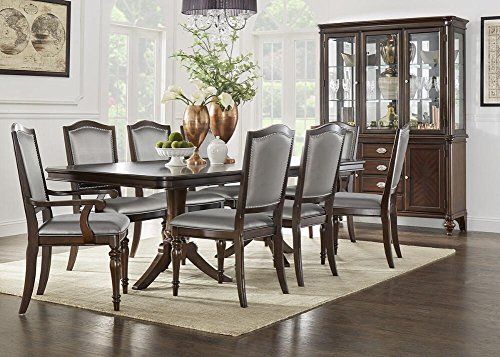
Image resolution: width=500 pixels, height=357 pixels. In order to click on dining room chairs in this screenshot , I will do `click(225, 225)`, `click(297, 205)`, `click(387, 205)`, `click(352, 136)`, `click(146, 138)`, `click(85, 138)`, `click(31, 163)`.